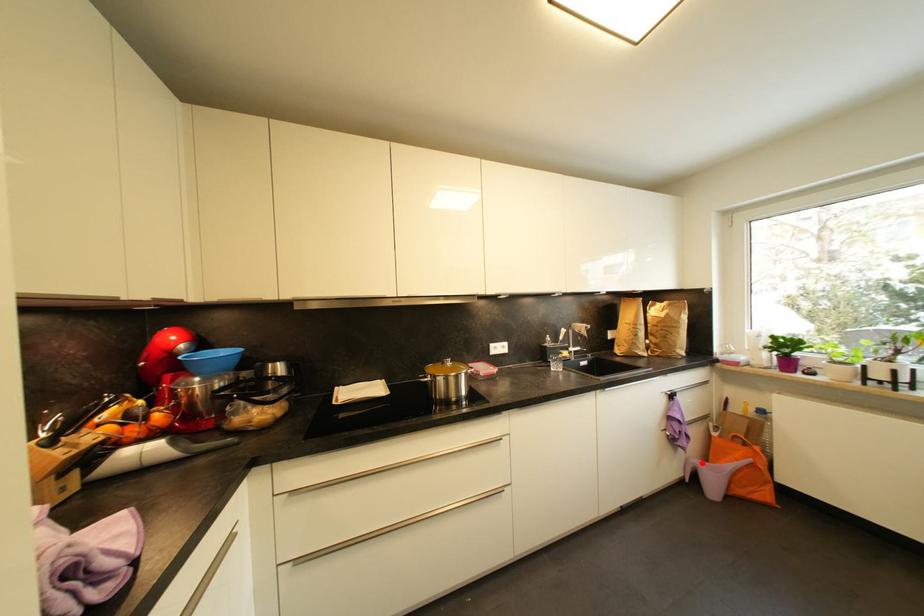
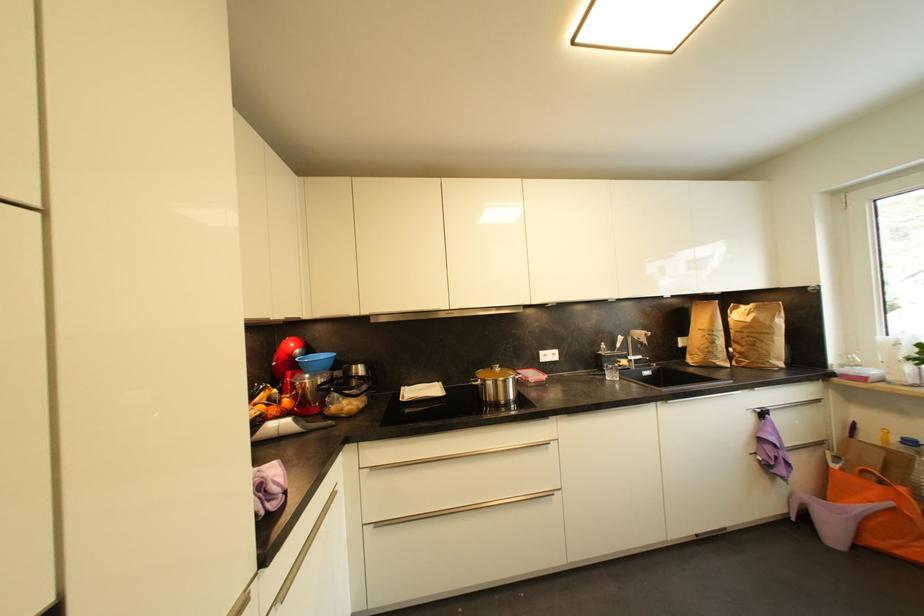
Where in the second image is the point corresponding to the highlighted location from the first image?

(811, 498)